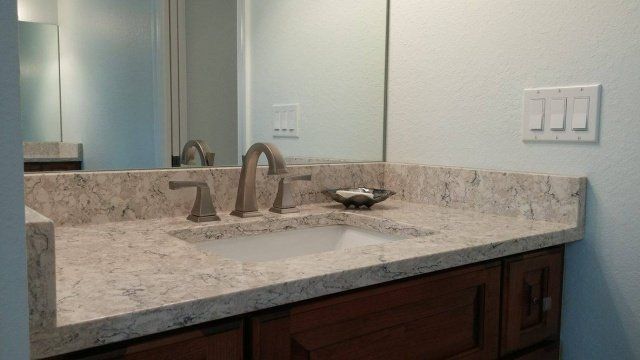
Find the location of a particular element. mirror is located at coordinates (124, 73).